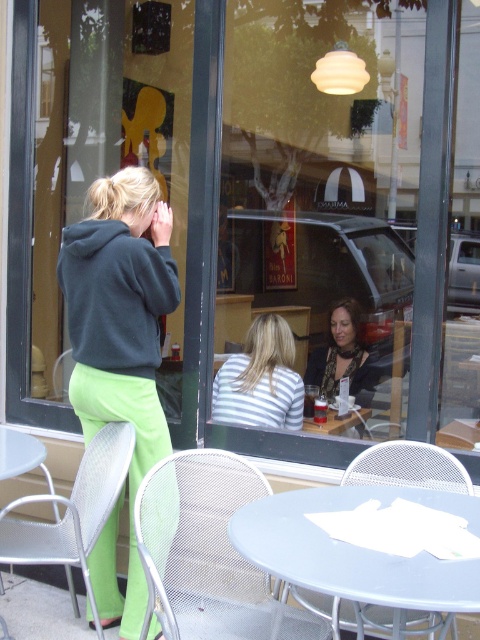
You are standing outside the cafe and looking through the window. There are two points marked on the glass at coordinates point (230, 481) and point (251, 397). Which point is nearer to your eyes?

Point (230, 481) is closer to the camera than point (251, 397), so the point (230, 481) is nearer to your eyes.